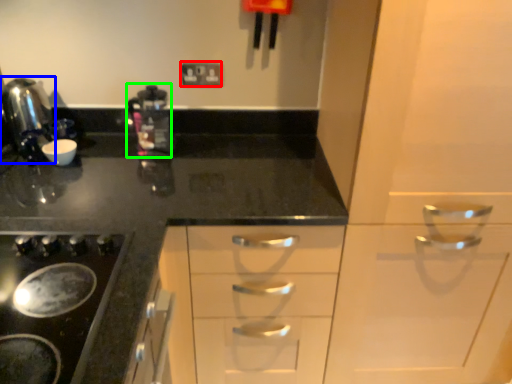
Question: Estimate the real-world distances between objects in this image. Which object is farther from electric outlet (highlighted by a red box), kitchen appliance (highlighted by a blue box) or coffee machine (highlighted by a green box)?

Choices:
 (A) kitchen appliance
 (B) coffee machine

Answer: (A)